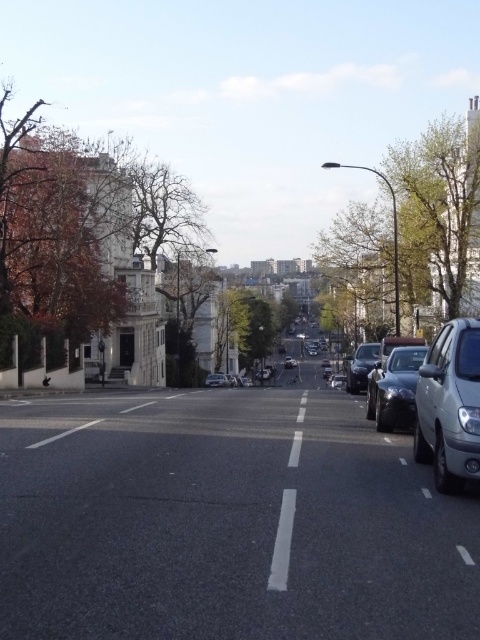
You are a pedestrian standing at the crosswalk. You see a satin black sedan at right and a green leafy tree at center. Which object is closer to you?

The satin black sedan at right is closer to you because it is in front of the green leafy tree at center.

You are a delivery driver who needs to park your 1.8 meter wide truck next to the satin silver car at right. The green leafy tree at right is blocking part of the parking space. Can you fit your truck between the tree and the car?

The green leafy tree at right is bigger than the satin silver car at right, but the size comparison does not provide information about the available space between them. Without knowing the exact distance between the tree and the car, it is impossible to determine if the truck can fit.